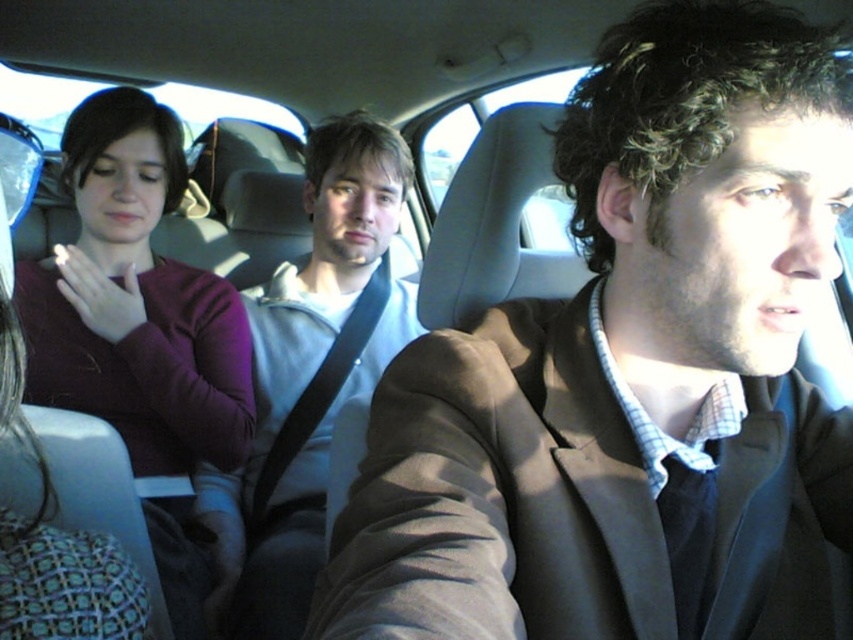
You are sitting in the backseat of the car and want to hand a book to the person wearing the purple sweater at left and the light gray hoodie at center. Which person will you have to reach higher to give the book to?

The light gray hoodie at center is taller than the purple sweater at left, so you will have to reach higher to give the book to the light gray hoodie at center.

You are sitting in the backseat of the car and want to know which clothing item is shorter between the brown fabric jacket at center and the light gray hoodie at center. Which one should you point out?

The brown fabric jacket at center is shorter than the light gray hoodie at center.

You are a passenger in the car and want to know if your backpack can fit between the brown fabric jacket at center and the light gray hoodie at center. The backpack is 1.2 feet wide. Can it fit?

The brown fabric jacket at center is wider than the light gray hoodie at center. The combined width of both items is not provided, so it is uncertain if the backpack can fit between them.